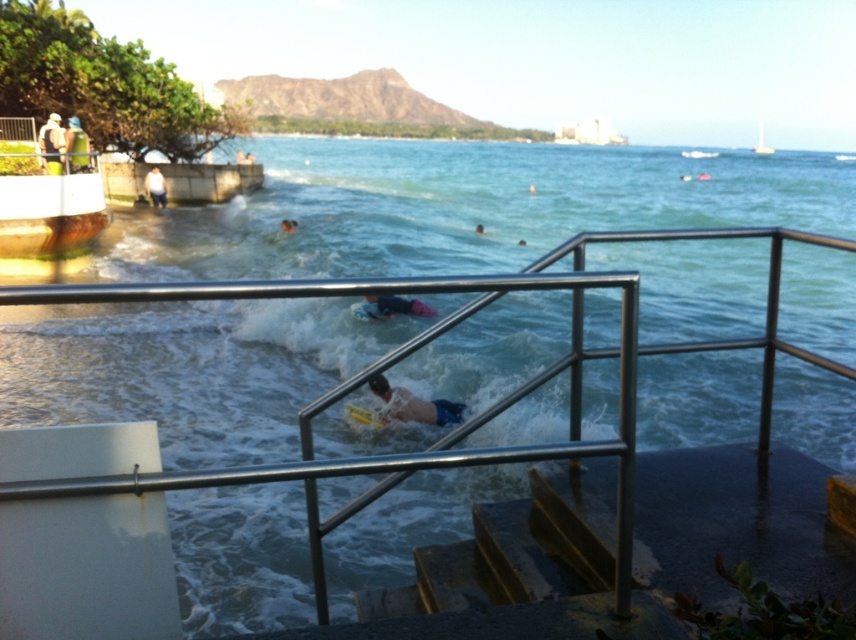
Can you confirm if white matte surfboard at center is positioned to the right of blue fabric surfboard at center?

Indeed, white matte surfboard at center is positioned on the right side of blue fabric surfboard at center.

Between white matte surfboard at center and blue fabric surfboard at center, which one has more height?

With more height is blue fabric surfboard at center.

Describe the element at coordinates (413, 404) in the screenshot. I see `white matte surfboard at center` at that location.

What are the coordinates of `white matte surfboard at center` in the screenshot? It's located at (413, 404).

Does matte black surfboard at upper left have a larger size compared to green fabric bag at upper left?

Actually, matte black surfboard at upper left might be smaller than green fabric bag at upper left.

You are a GUI agent. You are given a task and a screenshot of the screen. Output one action in this format:
    pyautogui.click(x=<x>, y=<y>)
    Task: Click on the matte black surfboard at upper left
    The image size is (856, 640).
    Given the screenshot: What is the action you would take?
    pyautogui.click(x=52, y=144)

Does rusty metal stairs at lower center lie in front of matte black surfboard at upper left?

Yes, it is.

Can you confirm if rusty metal stairs at lower center is wider than matte black surfboard at upper left?

Indeed, rusty metal stairs at lower center has a greater width compared to matte black surfboard at upper left.

You are a GUI agent. You are given a task and a screenshot of the screen. Output one action in this format:
    pyautogui.click(x=<x>, y=<y>)
    Task: Click on the rusty metal stairs at lower center
    The image size is (856, 640).
    Given the screenshot: What is the action you would take?
    pyautogui.click(x=512, y=554)